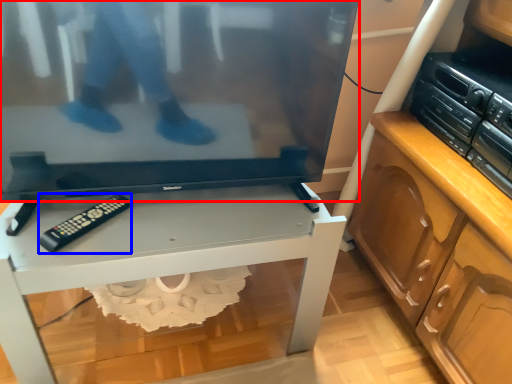
Question: Which object is closer to the camera taking this photo, television (highlighted by a red box) or control (highlighted by a blue box)?

Choices:
 (A) television
 (B) control

Answer: (A)